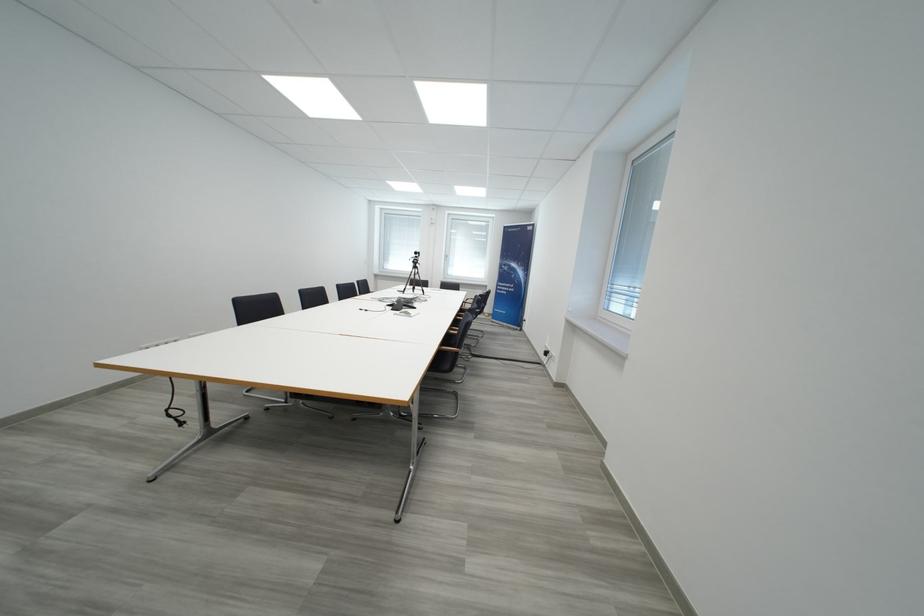
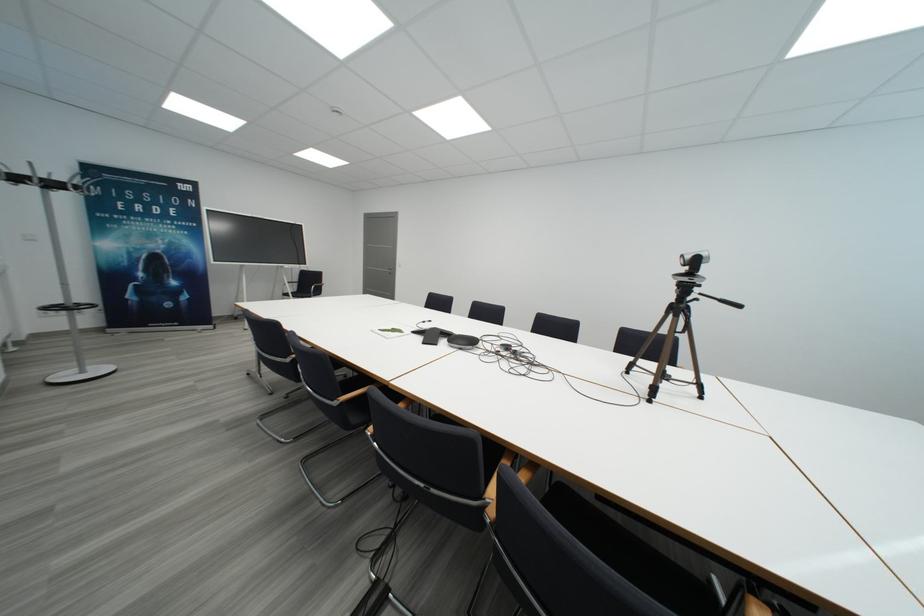
Find the pixel in the second image that matches point (427, 257) in the first image.

(702, 265)